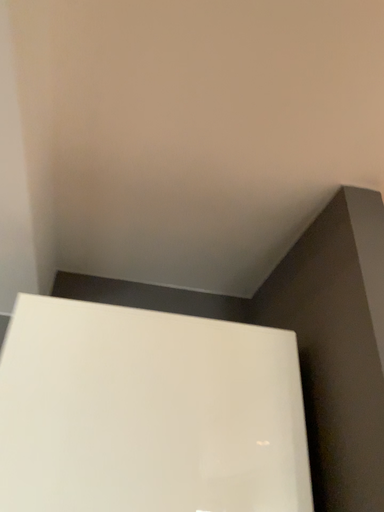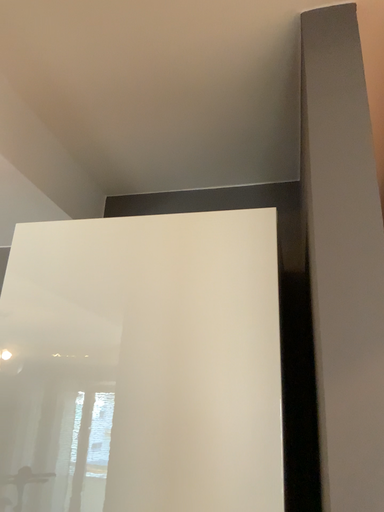
Question: How did the camera likely rotate when shooting the video?

Choices:
 (A) rotated downward
 (B) rotated upward

Answer: (A)